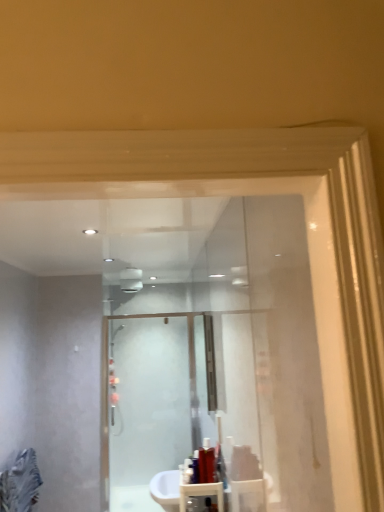
Question: Does shiny red bottle at lower center, which is counted as the third toiletry, starting from the right, have a larger size compared to shiny red bottle at lower center, the third toiletry positioned from the back?

Choices:
 (A) yes
 (B) no

Answer: (B)

Question: Considering the relative positions of shiny red bottle at lower center, which appears as the 2th toiletry when viewed from the back, and shiny red bottle at lower center, which appears as the second toiletry when viewed from the left, in the image provided, is shiny red bottle at lower center, which appears as the 2th toiletry when viewed from the back, to the left of shiny red bottle at lower center, which appears as the second toiletry when viewed from the left, from the viewer's perspective?

Choices:
 (A) yes
 (B) no

Answer: (A)

Question: Can you confirm if shiny red bottle at lower center, which is counted as the third toiletry, starting from the right, is shorter than shiny red bottle at lower center, arranged as the second toiletry when viewed from the right?

Choices:
 (A) yes
 (B) no

Answer: (A)

Question: From a real-world perspective, is shiny red bottle at lower center, which is the 2th toiletry in front-to-back order, on shiny red bottle at lower center, which appears as the second toiletry when viewed from the left?

Choices:
 (A) yes
 (B) no

Answer: (B)

Question: Does shiny red bottle at lower center, which is the 2th toiletry in front-to-back order, have a smaller size compared to shiny red bottle at lower center, arranged as the second toiletry when viewed from the right?

Choices:
 (A) yes
 (B) no

Answer: (A)

Question: Is shiny red bottle at lower center, which is counted as the third toiletry, starting from the right, thinner than shiny red bottle at lower center, arranged as the second toiletry when viewed from the right?

Choices:
 (A) no
 (B) yes

Answer: (A)

Question: From the image's perspective, is translucent plastic bottle at center, marked as the first toiletry in a right-to-left arrangement, located above shiny red bottle at lower center, which is the 2th toiletry in front-to-back order?

Choices:
 (A) yes
 (B) no

Answer: (A)

Question: Is translucent plastic bottle at center, marked as the first toiletry in a right-to-left arrangement, looking in the opposite direction of shiny red bottle at lower center, the 1th toiletry when ordered from left to right?

Choices:
 (A) no
 (B) yes

Answer: (A)

Question: From a real-world perspective, is translucent plastic bottle at center, which appears as the first toiletry when viewed from the back, on shiny red bottle at lower center, the 1th toiletry when ordered from left to right?

Choices:
 (A) no
 (B) yes

Answer: (B)

Question: From a real-world perspective, does translucent plastic bottle at center, which appears as the first toiletry when viewed from the back, sit lower than shiny red bottle at lower center, the 1th toiletry when ordered from left to right?

Choices:
 (A) yes
 (B) no

Answer: (B)

Question: Is translucent plastic bottle at center, which is the third toiletry from left to right, facing towards shiny red bottle at lower center, which appears as the 2th toiletry when viewed from the back?

Choices:
 (A) no
 (B) yes

Answer: (A)

Question: Is translucent plastic bottle at center, which appears as the first toiletry when viewed from the back, located outside shiny red bottle at lower center, which is counted as the third toiletry, starting from the right?

Choices:
 (A) yes
 (B) no

Answer: (A)

Question: Is shiny red bottle at lower center, which appears as the second toiletry when viewed from the left, positioned far away from translucent plastic bottle at center, which is the third toiletry from left to right?

Choices:
 (A) yes
 (B) no

Answer: (B)